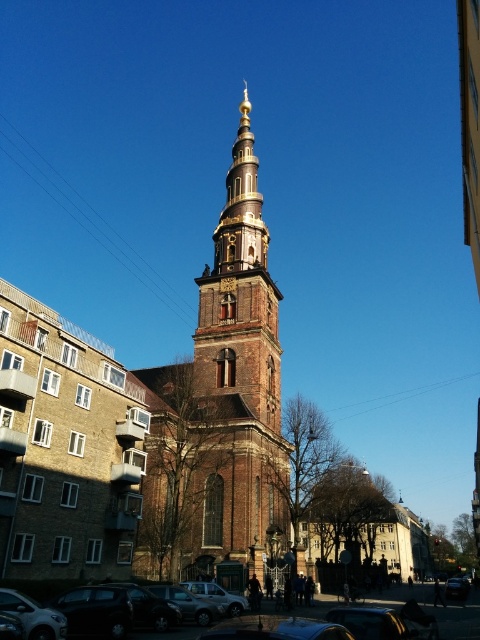
From the picture: You are standing at the point labeled as point (220, 406) in the image. What structure are you directly facing?

The point (220, 406) is directly facing the brown brick tower at center.